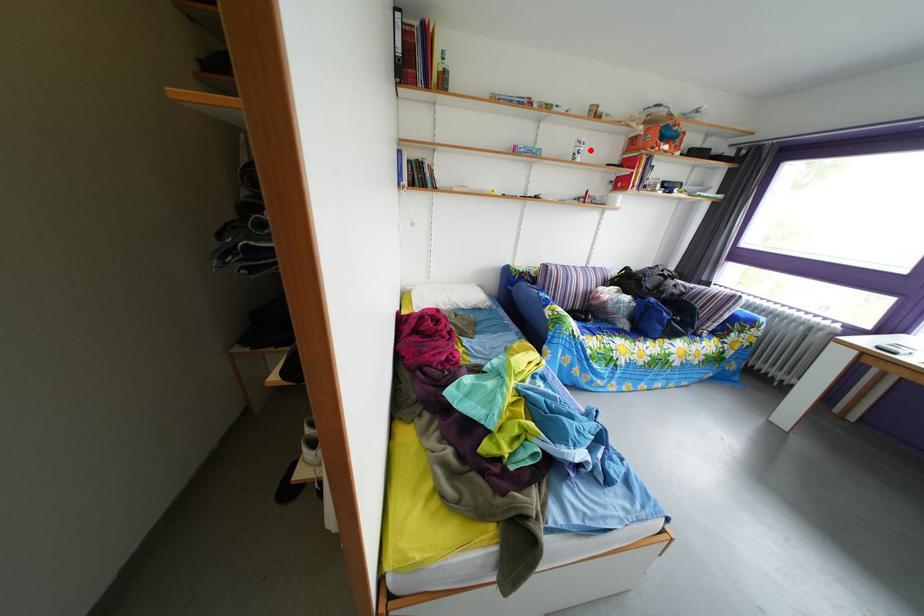
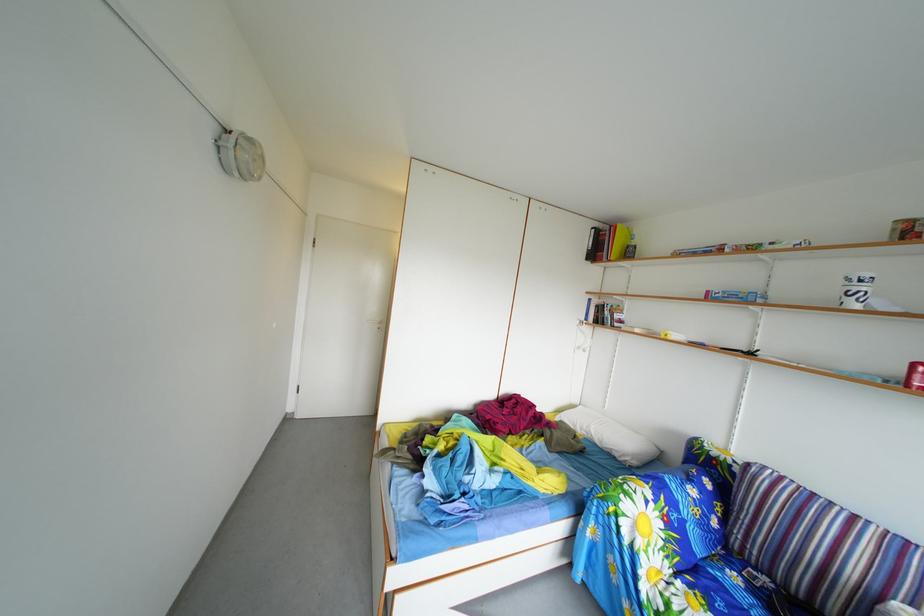
Question: I am providing you with two images of the same scene from different viewpoints. A red point is marked on the first image. Is the red point's position out of view in image 2?

Choices:
 (A) Yes
 (B) No

Answer: (B)